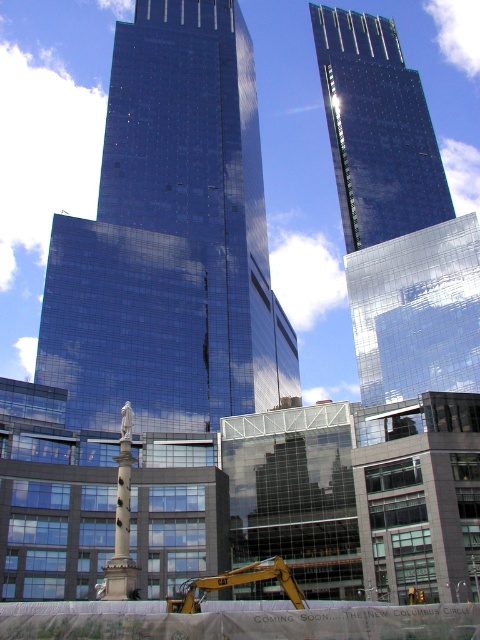
From the picture: Who is more distant from viewer, (276,573) or (123,419)?

Point (123,419)

Does yellow metallic excavator at lower center have a lesser height compared to white marble statue at lower center?

In fact, yellow metallic excavator at lower center may be taller than white marble statue at lower center.

Measure the distance between point [168,598] and camera.

Point [168,598] is 177.85 feet away from camera.

Locate an element on the screen. Image resolution: width=480 pixels, height=640 pixels. yellow metallic excavator at lower center is located at coordinates (237, 584).

Does glossy glass skyscraper at center appear under yellow metallic excavator at lower center?

Actually, glossy glass skyscraper at center is above yellow metallic excavator at lower center.

Between glossy glass skyscraper at center and yellow metallic excavator at lower center, which one is positioned lower?

yellow metallic excavator at lower center

Who is more forward, [243,273] or [181,593]?

Positioned in front is point [181,593].

Find the location of a particular element. The width and height of the screenshot is (480, 640). glossy glass skyscraper at center is located at coordinates (169, 237).

Does glossy glass skyscraper at center have a greater height compared to glossy glass skyscraper at upper center?

Yes, glossy glass skyscraper at center is taller than glossy glass skyscraper at upper center.

Can you confirm if glossy glass skyscraper at center is bigger than glossy glass skyscraper at upper center?

Yes, glossy glass skyscraper at center is bigger than glossy glass skyscraper at upper center.

Who is more distant from viewer, (173, 29) or (370, 33)?

The point (370, 33) is more distant.

Where is `glossy glass skyscraper at center`? The image size is (480, 640). glossy glass skyscraper at center is located at coordinates (169, 237).